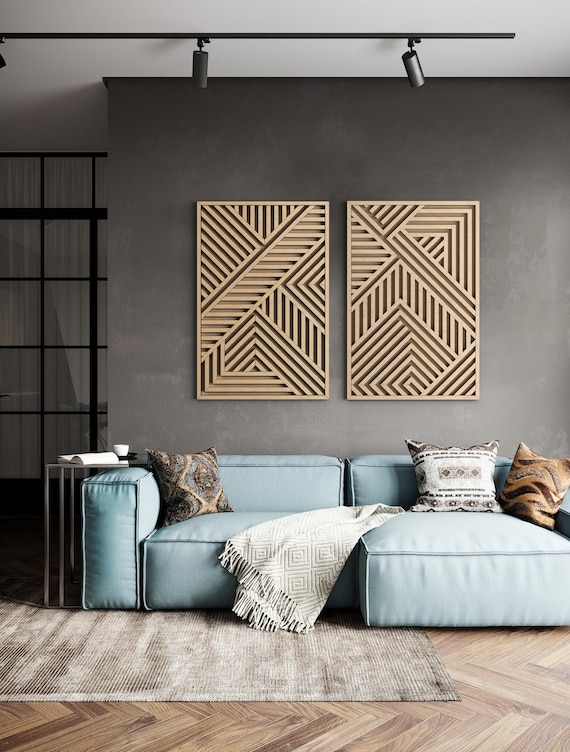
This screenshot has width=570, height=752. Identify the location of arm rest. (116, 499).